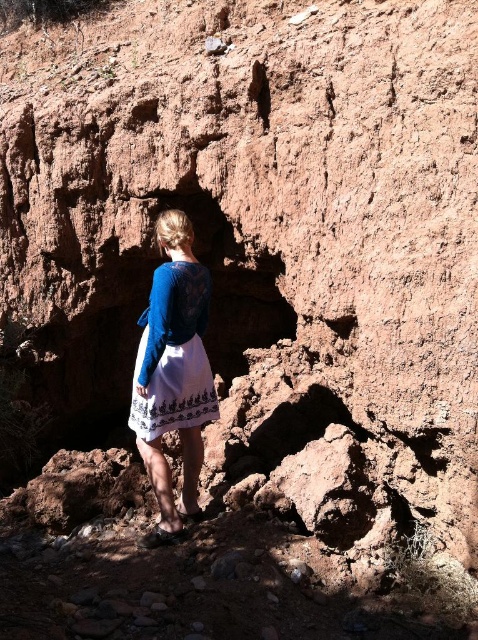
You are a photographer planning to take a photo of the blue lace dress at center and the white embroidered dress at center. The camera you are using has a minimum focus distance of 1 meter. Can both dresses be captured clearly in the photo without moving them?

The distance between the blue lace dress at center and the white embroidered dress at center is 12.60 centimeters. Since the minimum focus distance is 1 meter, the camera cannot focus on objects closer than 1 meter. Therefore, the dresses are too close to each other to be captured clearly without moving them.

In the scene shown: You are an observer looking at the entrance of a small cave. You see a blue lace dress at center and a white embroidered dress at center. Which dress is taller?

The blue lace dress at center is taller than the white embroidered dress at center.